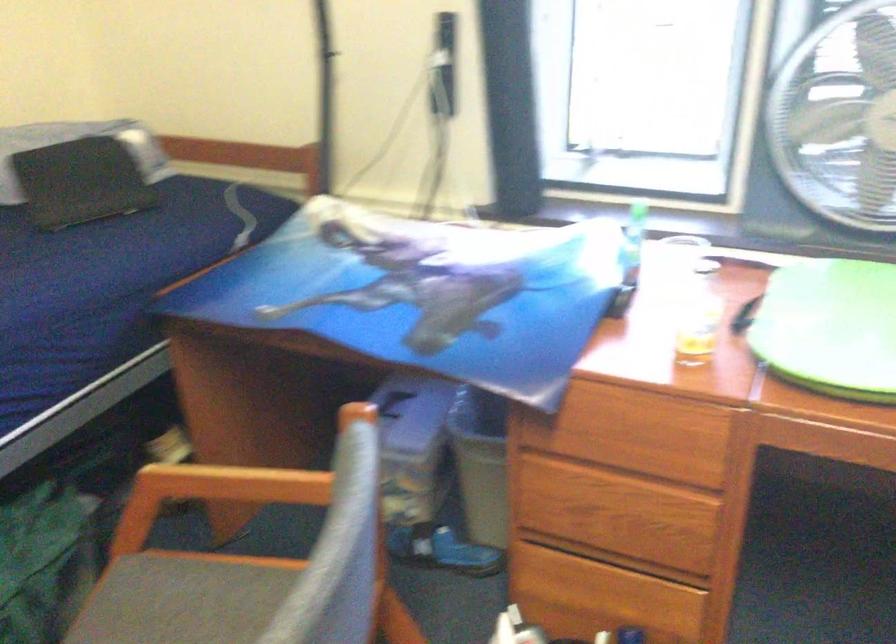
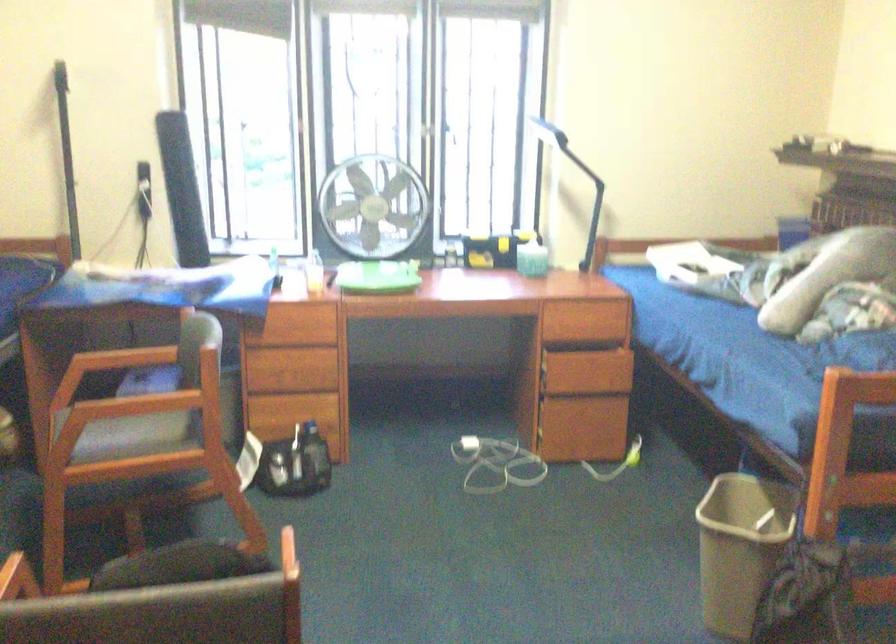
Where in the second image is the point corresponding to (x=248, y=488) from the first image?

(128, 357)